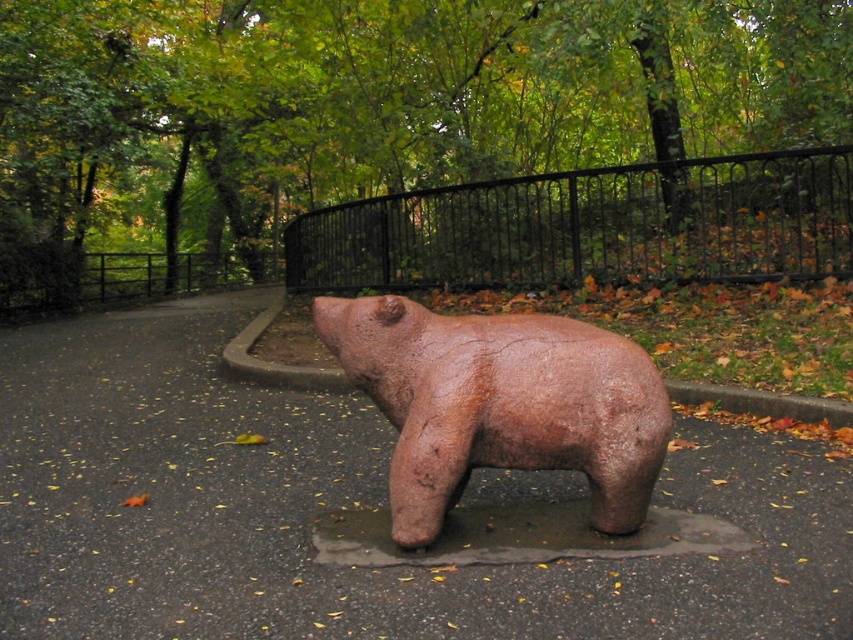
Can you confirm if black wrought iron fence at upper center is positioned below brown matte bear at center?

No.

Which is behind, point (822, 164) or point (518, 404)?

The point (822, 164) is behind.

Locate an element on the screen. black wrought iron fence at upper center is located at coordinates (589, 227).